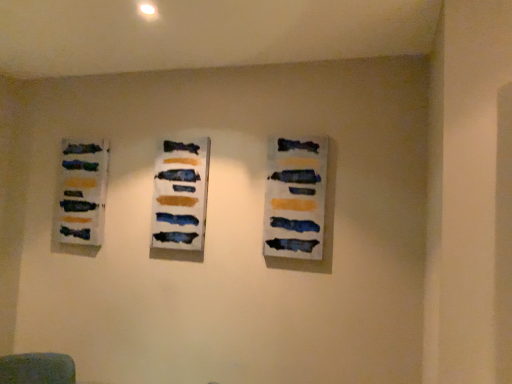
Question: In terms of width, does matte acrylic painting at center, the third art exhibition from the left, look wider or thinner when compared to textured acrylic painting at left, acting as the 3th art exhibition starting from the front?

Choices:
 (A) wide
 (B) thin

Answer: (B)

Question: Based on their sizes in the image, would you say matte acrylic painting at center, which ranks as the first art exhibition in right-to-left order, is bigger or smaller than textured acrylic painting at left, acting as the 3th art exhibition starting from the front?

Choices:
 (A) big
 (B) small

Answer: (B)

Question: Considering the real-world distances, which object is farthest from the matte acrylic painting at center, marked as the first art exhibition in a front-to-back arrangement?

Choices:
 (A) textured acrylic painting at left, acting as the third art exhibition starting from the right
 (B) matte acrylic painting at center, which ranks as the second art exhibition in right-to-left order

Answer: (A)

Question: Estimate the real-world distances between objects in this image. Which object is farther from the textured acrylic painting at left, acting as the 3th art exhibition starting from the front?

Choices:
 (A) matte acrylic painting at center, which ranks as the second art exhibition in right-to-left order
 (B) matte acrylic painting at center, the third art exhibition from the left

Answer: (B)